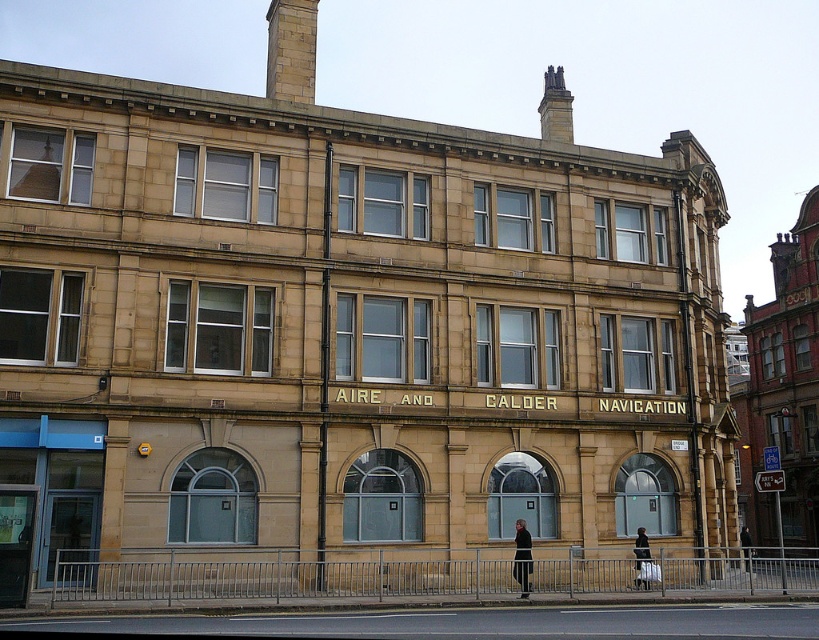
Question: Which object is positioned closest to the white fabric bag at center?

Choices:
 (A) dark gray jacket at center
 (B) black fabric at center

Answer: (B)

Question: Which object is closer to the camera taking this photo?

Choices:
 (A) white fabric bag at center
 (B) black fabric at center

Answer: (B)

Question: Can you confirm if white fabric bag at center is wider than dark gray jacket at center?

Choices:
 (A) no
 (B) yes

Answer: (A)

Question: Is black fabric at center further to the viewer compared to white fabric bag at center?

Choices:
 (A) no
 (B) yes

Answer: (A)

Question: Observing the image, what is the correct spatial positioning of white fabric bag at center in reference to dark gray jacket at center?

Choices:
 (A) below
 (B) above

Answer: (B)

Question: Which object appears farthest from the camera in this image?

Choices:
 (A) white fabric bag at center
 (B) dark gray jacket at center

Answer: (A)